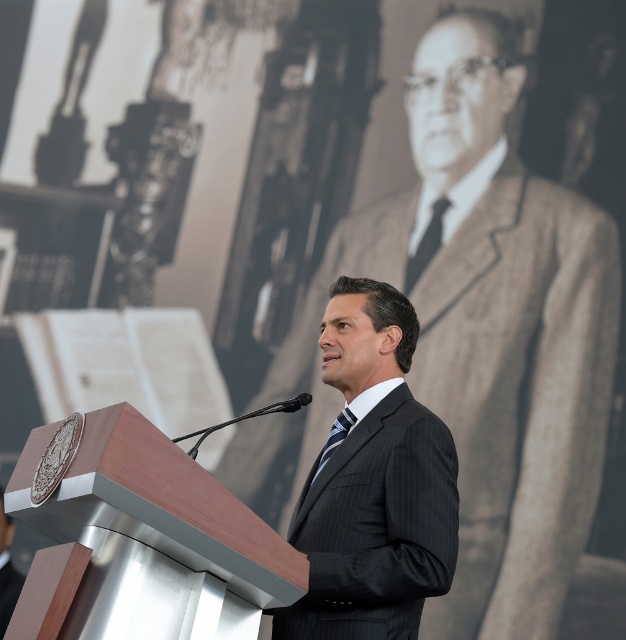
Question: Considering the relative positions of pinstriped suit at center and black silk tie at center in the image provided, where is pinstriped suit at center located with respect to black silk tie at center?

Choices:
 (A) below
 (B) above

Answer: (A)

Question: Which of the following is the farthest from the observer?

Choices:
 (A) black silk tie at center
 (B) wooden/metal podium at center
 (C) dark gray pinstripe suit at center

Answer: (A)

Question: Does wooden/metal podium at center have a lesser width compared to black pinstripe suit at center?

Choices:
 (A) no
 (B) yes

Answer: (A)

Question: Which object is farther from the camera taking this photo?

Choices:
 (A) dark gray pinstripe suit at center
 (B) wooden/metal podium at center

Answer: (A)

Question: Estimate the real-world distances between objects in this image. Which object is closer to the striped fabric tie at center?

Choices:
 (A) pinstriped suit at center
 (B) black silk tie at center

Answer: (A)

Question: Can you confirm if pinstriped suit at center is bigger than striped fabric tie at center?

Choices:
 (A) no
 (B) yes

Answer: (B)